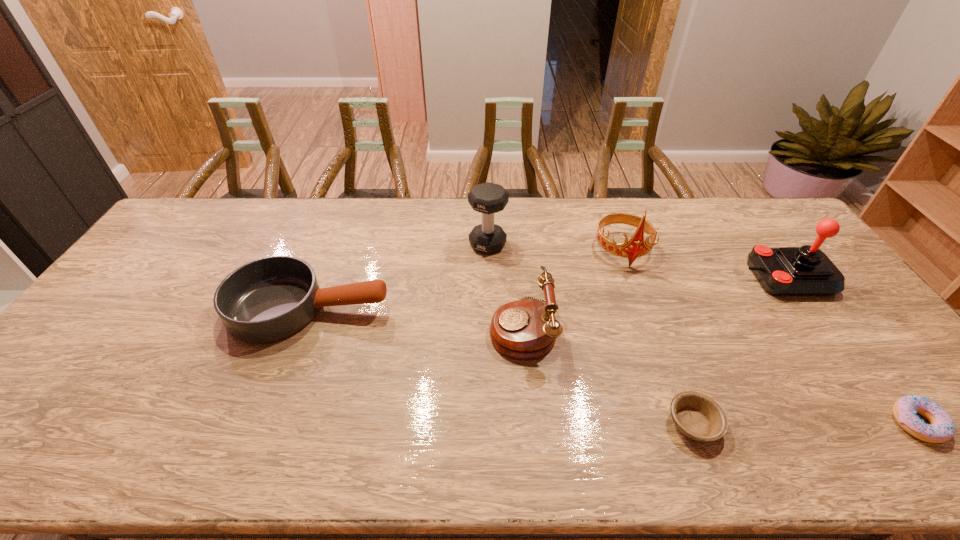
Locate an element on the screen. dumbbell that is at the far edge is located at coordinates (487, 198).

Find the location of a particular element. doughnut at the near edge is located at coordinates (942, 428).

I want to click on bowl present at the near edge, so click(x=697, y=416).

Identify the location of joystick that is at the right edge. tap(786, 271).

Where is `doughnut located in the right edge section of the desktop`? Image resolution: width=960 pixels, height=540 pixels. doughnut located in the right edge section of the desktop is located at coordinates (942, 428).

Locate an element on the screen. The image size is (960, 540). object located at the near right corner is located at coordinates [x=942, y=428].

This screenshot has height=540, width=960. In the image, there is a desktop. Identify the location of vacant space at the far edge. (x=459, y=201).

Where is `vacant region at the near edge`? vacant region at the near edge is located at coordinates (423, 457).

You are a GUI agent. You are given a task and a screenshot of the screen. Output one action in this format:
    pyautogui.click(x=<x>, y=<y>)
    Task: Click on the vacant space at the right edge of the desktop
    
    Given the screenshot: What is the action you would take?
    pyautogui.click(x=832, y=303)

At what (x,y) coordinates should I click in order to perform the action: click on vacant point at the far right corner. Please return your answer as a coordinate pair (x, y). Looking at the image, I should click on click(x=759, y=226).